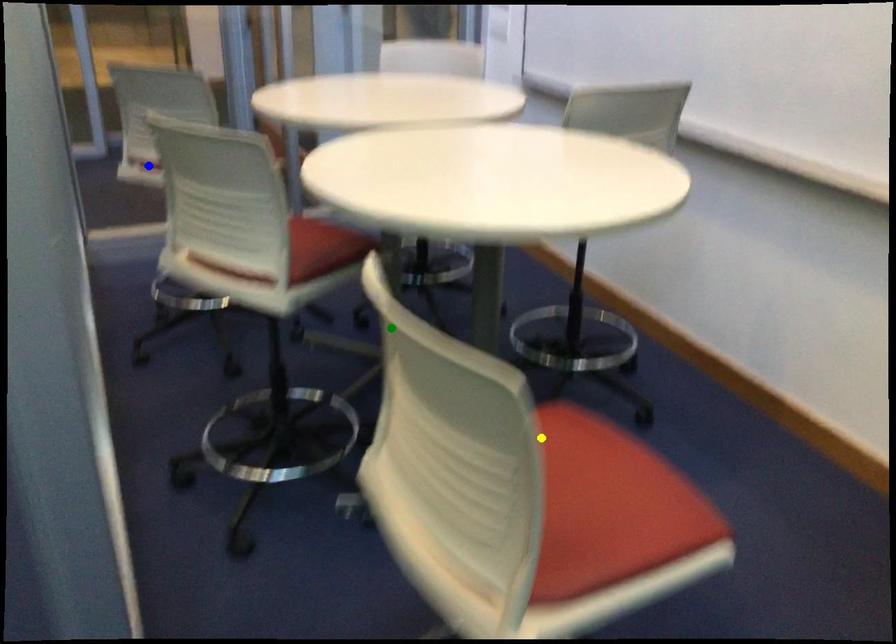
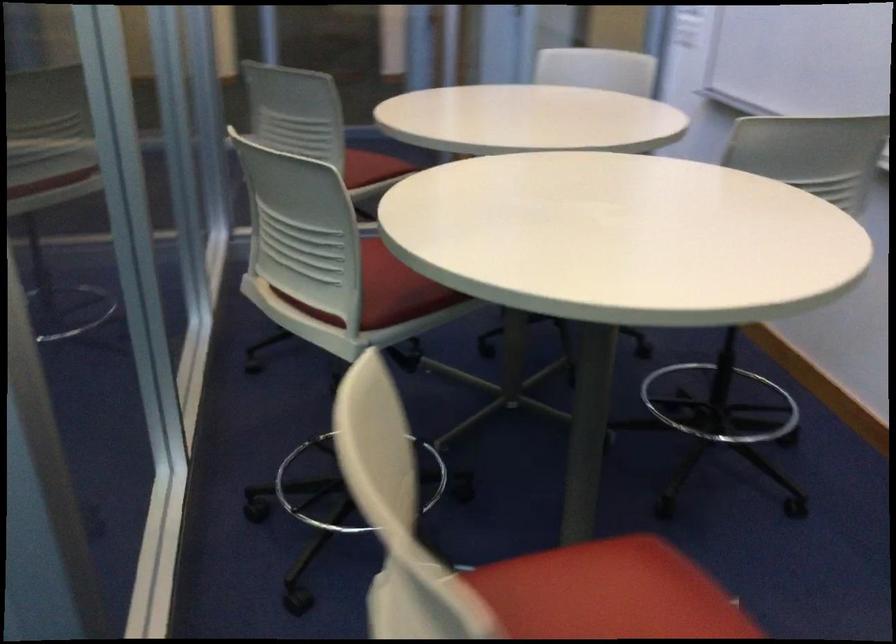
I am providing you with two images of the same scene from different viewpoints. Three points are marked in image1. Which point corresponds to a part or object that is occluded in image2?In image1, three points are marked. Which of them correspond to a part or object that is occluded in image2?Among the three points shown in image1, which one corresponds to a part or object that is no longer visible due to occlusion in image2?

blue point cannot be seen in image2.